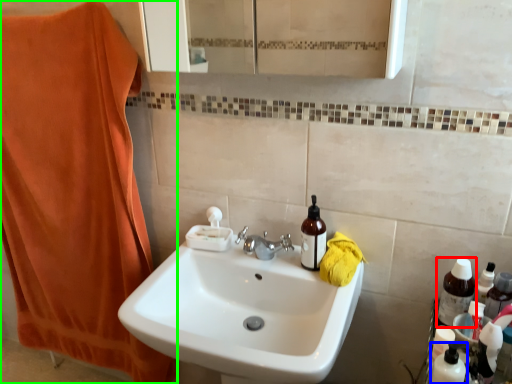
Question: Which is farther away from bottle (highlighted by a red box)? cleaning product (highlighted by a blue box) or bath towel (highlighted by a green box)?

Choices:
 (A) cleaning product
 (B) bath towel

Answer: (B)